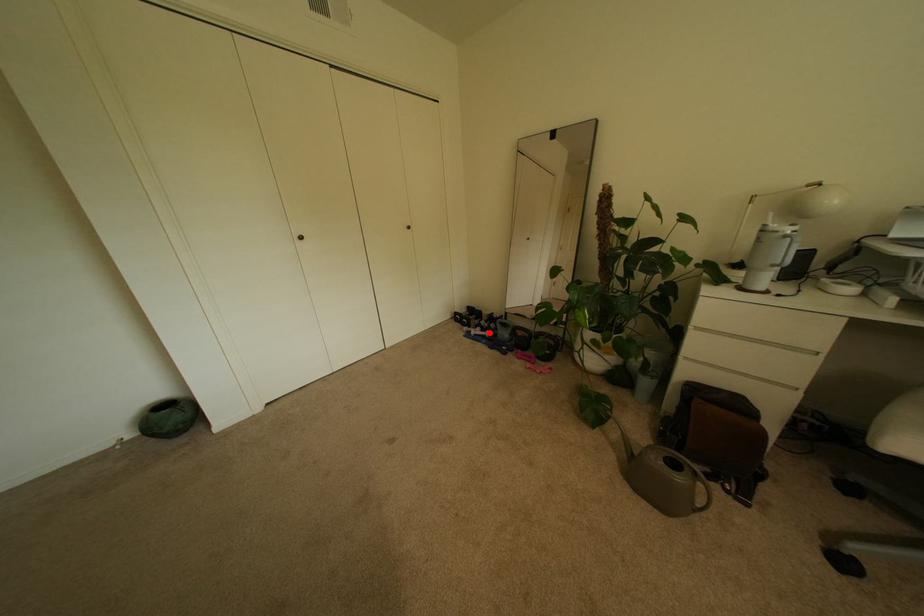
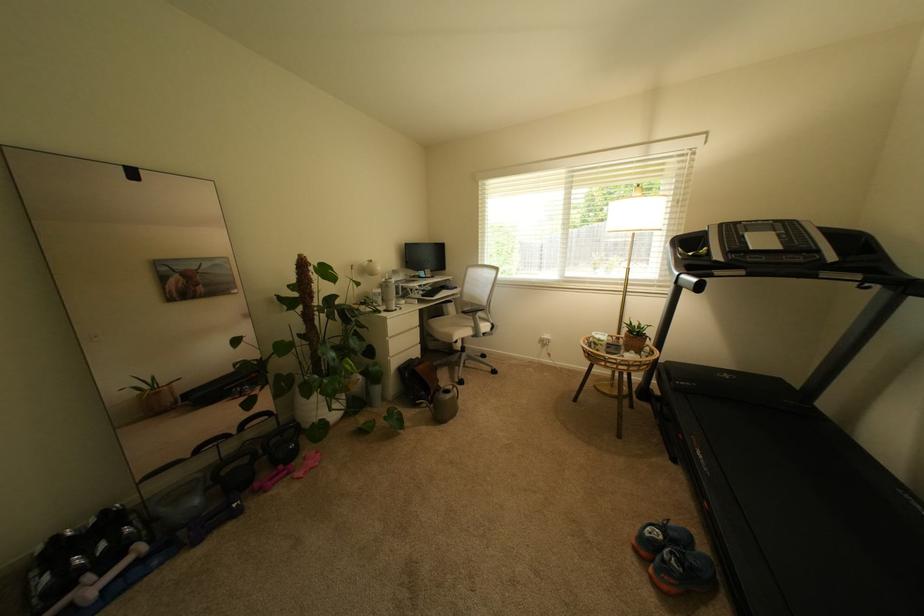
The point at the highlighted location is marked in the first image. Where is the corresponding point in the second image?

(111, 573)